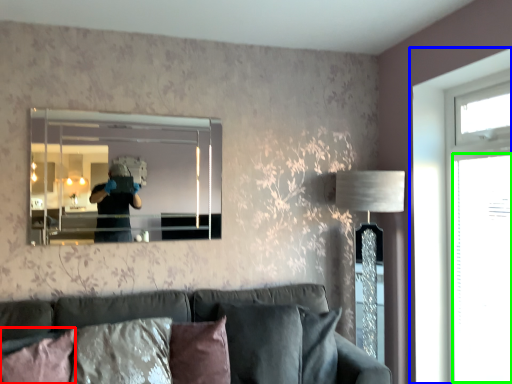
Question: Which is farther away from pillow (highlighted by a red box)? window (highlighted by a blue box) or glass door (highlighted by a green box)?

Choices:
 (A) window
 (B) glass door

Answer: (B)